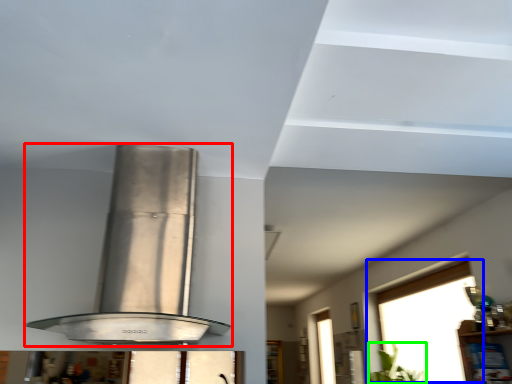
Question: Which object is the farthest from kitchen appliance (highlighted by a red box)? Choose among these: window (highlighted by a blue box) or plant (highlighted by a green box).

Choices:
 (A) window
 (B) plant

Answer: (B)